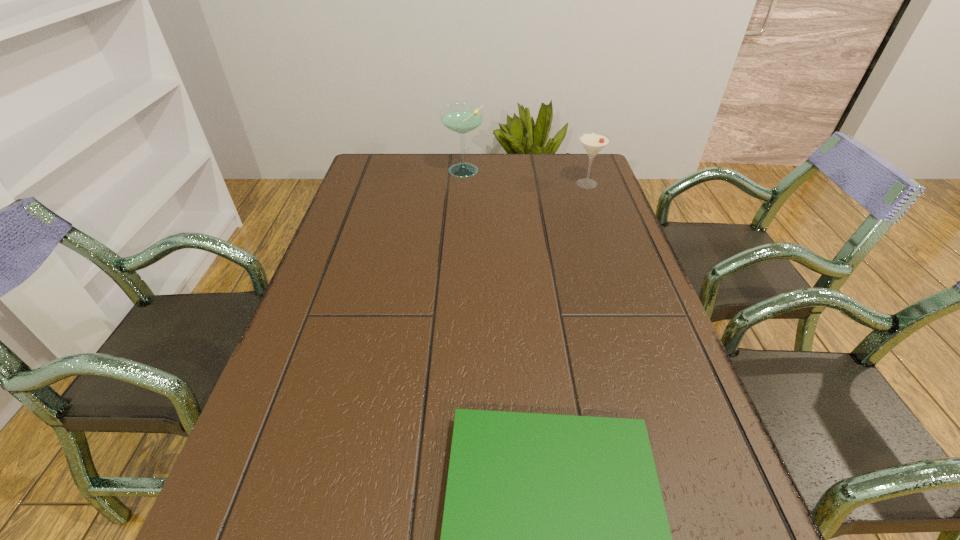
Locate an element on the screen. The height and width of the screenshot is (540, 960). free region at the right edge of the desktop is located at coordinates (x=600, y=271).

You are a GUI agent. You are given a task and a screenshot of the screen. Output one action in this format:
    pyautogui.click(x=<x>, y=<y>)
    Task: Click on the vacant area at the far left corner of the desktop
    
    Given the screenshot: What is the action you would take?
    pyautogui.click(x=399, y=169)

Locate an element on the screen. This screenshot has width=960, height=540. free spot at the far right corner of the desktop is located at coordinates (593, 166).

Identify the location of free space between the taller martini and the shorter martini. The width and height of the screenshot is (960, 540). (525, 178).

At what (x,y) coordinates should I click in order to perform the action: click on free space between the right martini and the taller martini. Please return your answer as a coordinate pair (x, y). This screenshot has width=960, height=540. Looking at the image, I should click on 525,178.

I want to click on free space that is in between the right martini and the left martini, so click(x=525, y=178).

Locate an element on the screen. The height and width of the screenshot is (540, 960). vacant space that is in between the right martini and the tallest object is located at coordinates (525, 178).

Locate which object is the second closest to the second shortest object. Please provide its 2D coordinates. Your answer should be formatted as a tuple, i.e. [(x, y)], where the tuple contains the x and y coordinates of a point satisfying the conditions above.

[(555, 539)]

Identify the location of object that stands as the closest to the nearest object. The width and height of the screenshot is (960, 540). [593, 142].

The height and width of the screenshot is (540, 960). Find the location of `free location that satisfies the following two spatial constraints: 1. on the front side of the second tallest object; 2. on the right side of the taller martini`. free location that satisfies the following two spatial constraints: 1. on the front side of the second tallest object; 2. on the right side of the taller martini is located at coordinates (463, 184).